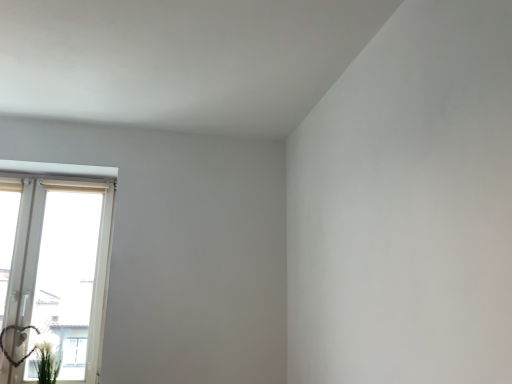
Describe the element at coordinates (54, 266) in the screenshot. I see `white plastic window at left` at that location.

Measure the distance between white plastic window at left and camera.

They are 8.22 feet apart.

This screenshot has height=384, width=512. Find the location of `white plastic window at left`. white plastic window at left is located at coordinates (54, 266).

What do you see at coordinates (47, 361) in the screenshot? This screenshot has width=512, height=384. I see `green leafy plant at lower left` at bounding box center [47, 361].

The image size is (512, 384). I want to click on green leafy plant at lower left, so click(x=47, y=361).

At what (x,y) coordinates should I click in order to perform the action: click on white plastic window at left. Please return your answer as a coordinate pair (x, y). The height and width of the screenshot is (384, 512). Looking at the image, I should click on (54, 266).

Between white plastic window at left and green leafy plant at lower left, which one appears on the left side from the viewer's perspective?

white plastic window at left.

Does white plastic window at left come behind green leafy plant at lower left?

Yes, white plastic window at left is behind green leafy plant at lower left.

Which point is more forward, (4,267) or (57,356)?

The point (57,356) is in front.

From the image's perspective, which is above, white plastic window at left or green leafy plant at lower left?

white plastic window at left, from the image's perspective.

From a real-world perspective, is white plastic window at left on top of green leafy plant at lower left?

Indeed, from a real-world perspective, white plastic window at left stands above green leafy plant at lower left.

Is white plastic window at left wider or thinner than green leafy plant at lower left?

Clearly, white plastic window at left has less width compared to green leafy plant at lower left.

Considering the relative sizes of white plastic window at left and green leafy plant at lower left in the image provided, is white plastic window at left shorter than green leafy plant at lower left?

In fact, white plastic window at left may be taller than green leafy plant at lower left.

Does white plastic window at left have a larger size compared to green leafy plant at lower left?

Yes, white plastic window at left is bigger than green leafy plant at lower left.

Is white plastic window at left spatially inside green leafy plant at lower left, or outside of it?

white plastic window at left is located beyond the bounds of green leafy plant at lower left.

Is there a large distance between white plastic window at left and green leafy plant at lower left?

No, white plastic window at left is in close proximity to green leafy plant at lower left.

Is green leafy plant at lower left at the back of white plastic window at left?

That's right, white plastic window at left is facing away from green leafy plant at lower left.

How different are the orientations of white plastic window at left and green leafy plant at lower left in degrees?

The angle between the facing direction of white plastic window at left and the facing direction of green leafy plant at lower left is 1.55 degrees.

Measure the distance between white plastic window at left and green leafy plant at lower left.

white plastic window at left and green leafy plant at lower left are 44.25 centimeters apart.

The height and width of the screenshot is (384, 512). What are the coordinates of `plant below the white plastic window at left (from a real-world perspective)` in the screenshot? It's located at coord(47,361).

In the scene shown: Considering the positions of objects green leafy plant at lower left and white plastic window at left in the image provided, who is more to the right, green leafy plant at lower left or white plastic window at left?

From the viewer's perspective, green leafy plant at lower left appears more on the right side.

Relative to white plastic window at left, is green leafy plant at lower left in front or behind?

green leafy plant at lower left is in front of white plastic window at left.

Which is closer to the camera, [42,346] or [8,177]?

Positioned in front is point [42,346].

From the image's perspective, between green leafy plant at lower left and white plastic window at left, which one is located above?

white plastic window at left is shown above in the image.

From a real-world perspective, is green leafy plant at lower left physically located above or below white plastic window at left?

In terms of real-world spatial position, green leafy plant at lower left is below white plastic window at left.

Considering the relative sizes of green leafy plant at lower left and white plastic window at left in the image provided, is green leafy plant at lower left thinner than white plastic window at left?

No.

Can you confirm if green leafy plant at lower left is shorter than white plastic window at left?

Indeed, green leafy plant at lower left has a lesser height compared to white plastic window at left.

Considering the sizes of green leafy plant at lower left and white plastic window at left in the image, is green leafy plant at lower left bigger or smaller than white plastic window at left?

green leafy plant at lower left is smaller than white plastic window at left.

Consider the image. Would you say green leafy plant at lower left is outside white plastic window at left?

green leafy plant at lower left lies outside white plastic window at left's area.

Is green leafy plant at lower left not near white plastic window at left?

That's not correct — green leafy plant at lower left is a little close to white plastic window at left.

Is green leafy plant at lower left positioned with its back to white plastic window at left?

Yes, green leafy plant at lower left is facing away from white plastic window at left.

How many degrees apart are the facing directions of green leafy plant at lower left and white plastic window at left?

There is a 1.55-degree angle between the facing directions of green leafy plant at lower left and white plastic window at left.

Locate an element on the screen. window behind the green leafy plant at lower left is located at coordinates (54, 266).

Image resolution: width=512 pixels, height=384 pixels. Find the location of `plant in front of the white plastic window at left`. plant in front of the white plastic window at left is located at coordinates (47, 361).

This screenshot has width=512, height=384. Identify the location of window above the green leafy plant at lower left (from the image's perspective). pyautogui.click(x=54, y=266).